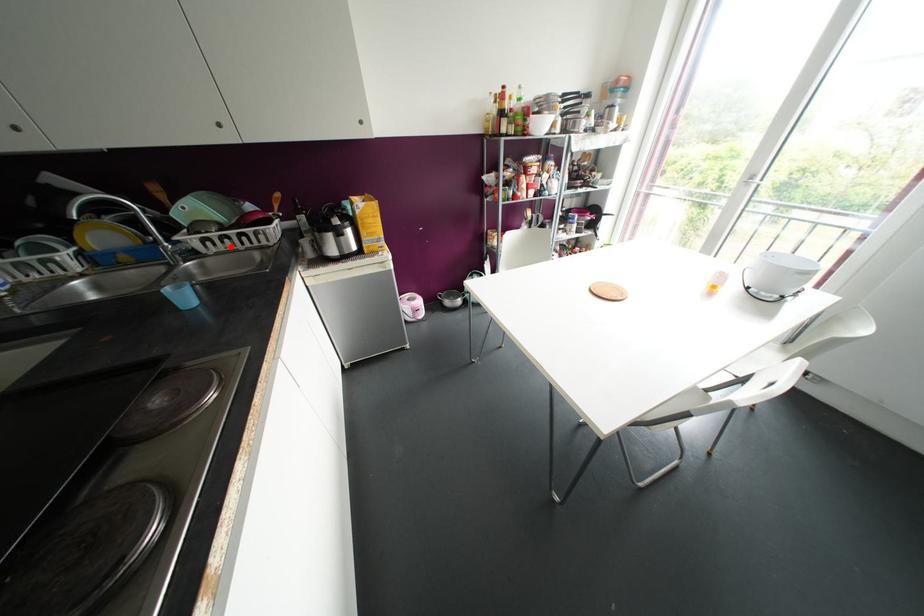
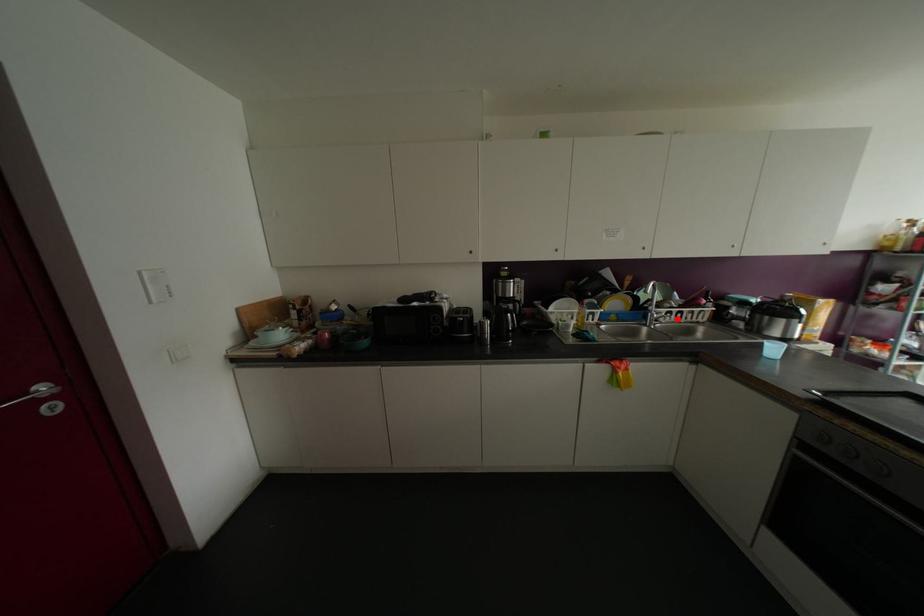
I am providing you with two images of the same scene from different viewpoints. A red point is marked on the first image and another point is marked on the second image. Is the red point in image1 aligned with the point shown in image2?

Yes